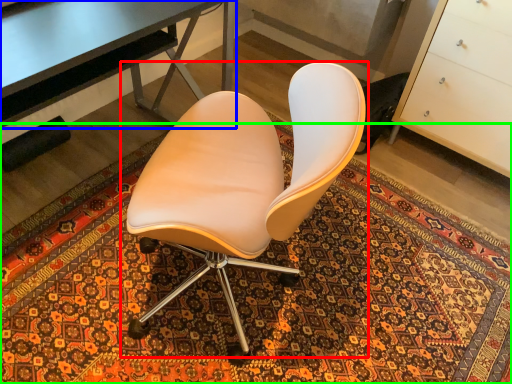
Question: Estimate the real-world distances between objects in this image. Which object is farther from chair (highlighted by a red box), desk (highlighted by a blue box) or mat (highlighted by a green box)?

Choices:
 (A) desk
 (B) mat

Answer: (B)